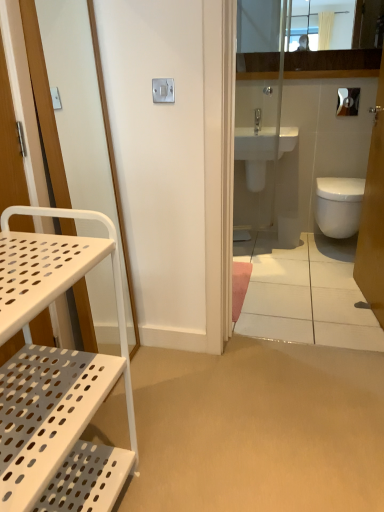
The width and height of the screenshot is (384, 512). What are the coordinates of `free space on the front side of white perforated shelf at left, which is the first screen door from left to right` in the screenshot? It's located at (140, 408).